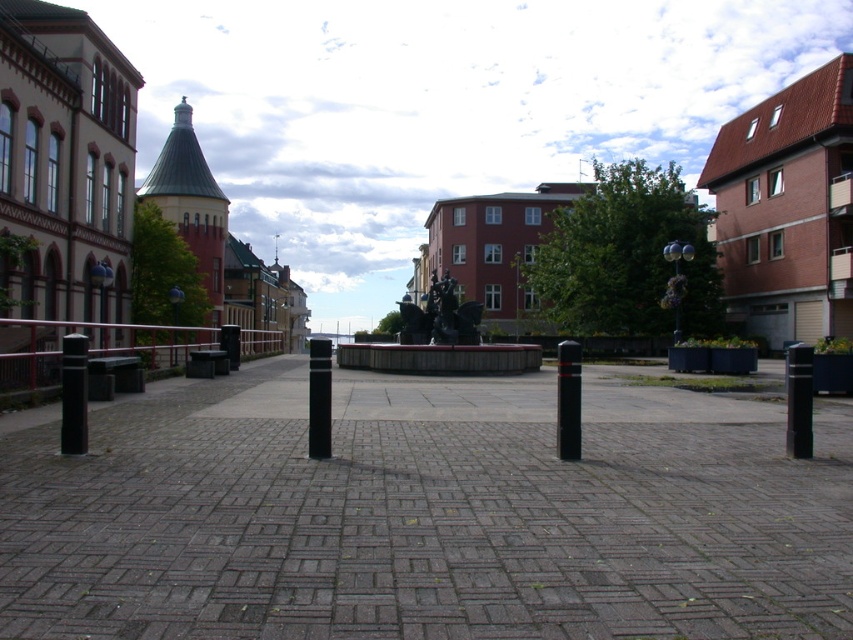
How distant is gray concrete pavement at center from red painted metal rail at left?

The distance of gray concrete pavement at center from red painted metal rail at left is 7.09 meters.

Does gray concrete pavement at center have a larger size compared to red painted metal rail at left?

Actually, gray concrete pavement at center might be smaller than red painted metal rail at left.

Where is `gray concrete pavement at center`? The height and width of the screenshot is (640, 853). gray concrete pavement at center is located at coordinates (426, 515).

Does red painted metal rail at left have a greater width compared to black rubber pole at center?

Correct, the width of red painted metal rail at left exceeds that of black rubber pole at center.

Is red painted metal rail at left taller than black rubber pole at center?

Indeed, red painted metal rail at left has a greater height compared to black rubber pole at center.

Identify the location of red painted metal rail at left. The height and width of the screenshot is (640, 853). (90, 348).

Find the location of a particular element. red painted metal rail at left is located at coordinates (90, 348).

Does red painted metal rail at left have a larger size compared to black matte pole at left?

Correct, red painted metal rail at left is larger in size than black matte pole at left.

Which is more to the right, red painted metal rail at left or black matte pole at left?

Positioned to the right is black matte pole at left.

Is point (142, 349) positioned after point (67, 412)?

Yes, point (142, 349) is farther from viewer.

Locate an element on the screen. Image resolution: width=853 pixels, height=640 pixels. red painted metal rail at left is located at coordinates point(90,348).